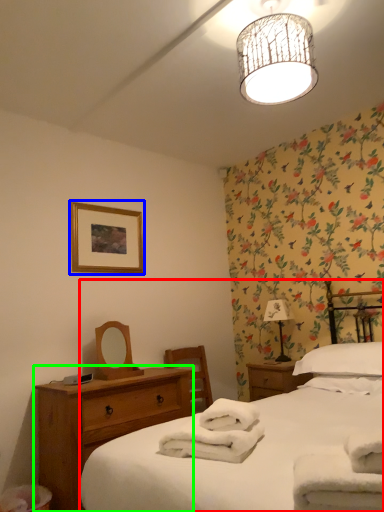
Question: Considering the real-world distances, which object is closest to bed (highlighted by a red box)? picture frame (highlighted by a blue box) or nightstand (highlighted by a green box).

Choices:
 (A) picture frame
 (B) nightstand

Answer: (B)